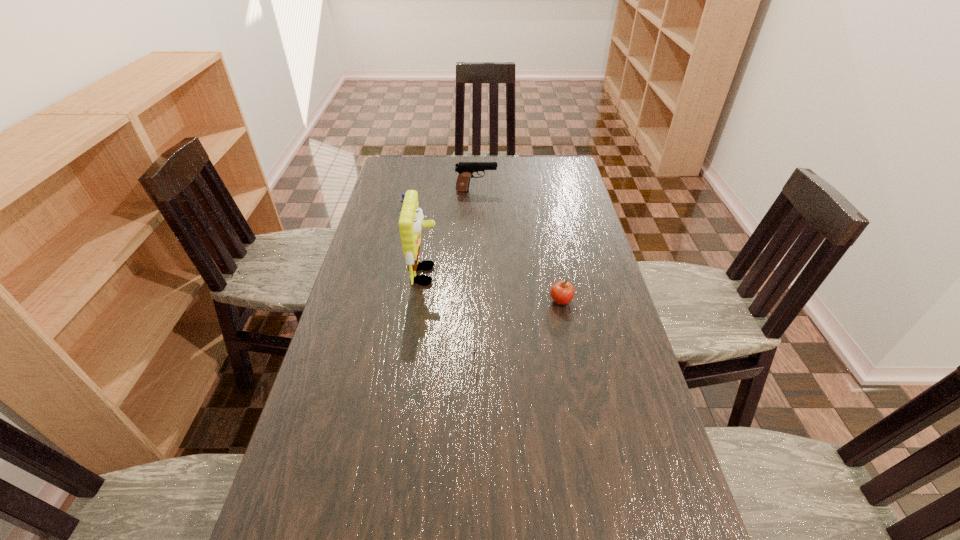
You are a GUI agent. You are given a task and a screenshot of the screen. Output one action in this format:
    pyautogui.click(x=<x>, y=<y>)
    Task: Click on the vacant area situated at the barrel of the farthest object
    
    Given the screenshot: What is the action you would take?
    pyautogui.click(x=512, y=191)

Where is `free space located on the face of the leftmost object, where the monocle is placed`? free space located on the face of the leftmost object, where the monocle is placed is located at coordinates (399, 257).

This screenshot has height=540, width=960. In order to click on free region located on the front of the rightmost object in this screenshot , I will do `click(586, 432)`.

The image size is (960, 540). I want to click on vacant space located in front of the lenses of the nearest object, so click(403, 368).

Where is `vacant space located 0.370m in front of the lenses of the nearest object`? The width and height of the screenshot is (960, 540). vacant space located 0.370m in front of the lenses of the nearest object is located at coordinates (330, 368).

At what (x,y) coordinates should I click in order to perform the action: click on blank area located 0.200m in front of the lenses of the nearest object. Please return your answer as a coordinate pair (x, y). The width and height of the screenshot is (960, 540). Looking at the image, I should click on (396, 368).

At what (x,y) coordinates should I click in order to perform the action: click on object that is at the left edge. Please return your answer as a coordinate pair (x, y). The height and width of the screenshot is (540, 960). Looking at the image, I should click on click(403, 194).

I want to click on object at the right edge, so click(562, 292).

This screenshot has width=960, height=540. What are the coordinates of `free space at the far edge of the desktop` in the screenshot? It's located at (528, 176).

Locate an element on the screen. This screenshot has height=540, width=960. vacant space at the left edge is located at coordinates (398, 247).